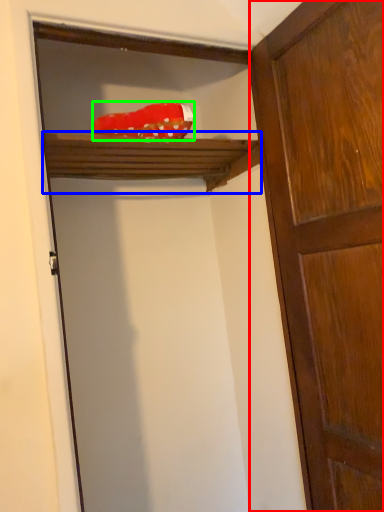
Question: Which object is positioned closest to door (highlighted by a red box)? Select from shelf (highlighted by a blue box) and material (highlighted by a green box).

Choices:
 (A) shelf
 (B) material

Answer: (A)